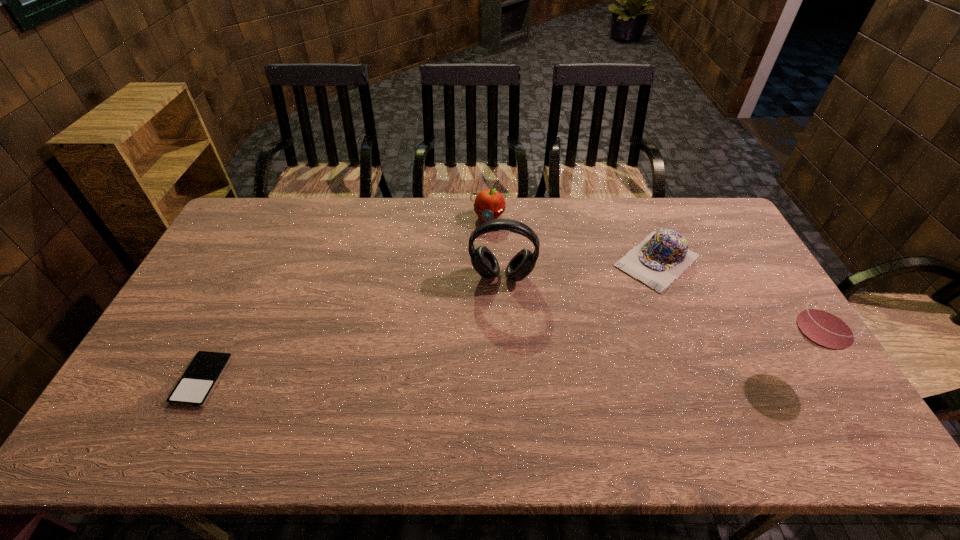
You are a GUI agent. You are given a task and a screenshot of the screen. Output one action in this format:
    pyautogui.click(x=<x>, y=<y>)
    Task: Click on the free space at the left edge of the desktop
    This screenshot has height=540, width=960.
    Given the screenshot: What is the action you would take?
    pyautogui.click(x=173, y=346)

This screenshot has height=540, width=960. In the image, there is a desktop. Find the location of `vacant space at the right edge`. vacant space at the right edge is located at coordinates (760, 278).

In the image, there is a desktop. Where is `vacant space at the far left corner`? vacant space at the far left corner is located at coordinates (253, 208).

The image size is (960, 540). I want to click on vacant area that lies between the farthest object and the cap, so click(x=572, y=239).

The height and width of the screenshot is (540, 960). What are the coordinates of `vacant point located between the fourth tallest object and the headset` in the screenshot? It's located at (580, 268).

This screenshot has width=960, height=540. I want to click on free space between the headset and the farthest object, so click(495, 247).

Image resolution: width=960 pixels, height=540 pixels. What are the coordinates of `free space between the farthest object and the leftmost object` in the screenshot? It's located at (345, 299).

Where is `vacant area that lies between the headset and the third shortest object`? This screenshot has width=960, height=540. vacant area that lies between the headset and the third shortest object is located at coordinates (495, 247).

The width and height of the screenshot is (960, 540). In order to click on vacant point located between the second shortest object and the wineglass in this screenshot , I will do `click(723, 314)`.

Identify the location of vacant space that is in between the apple and the leftmost object. (345, 299).